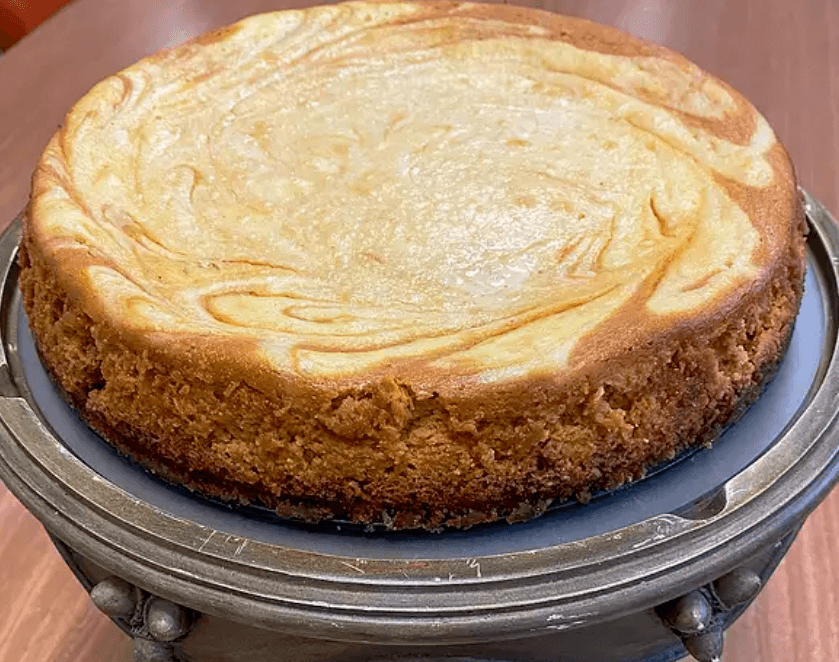
You are a GUI agent. You are given a task and a screenshot of the screen. Output one action in this format:
    pyautogui.click(x=<x>, y=<y>)
    Task: Click on the decor knobs in cake tray
    
    Given the screenshot: What is the action you would take?
    pyautogui.click(x=749, y=577), pyautogui.click(x=704, y=610), pyautogui.click(x=714, y=637), pyautogui.click(x=169, y=624), pyautogui.click(x=121, y=600)